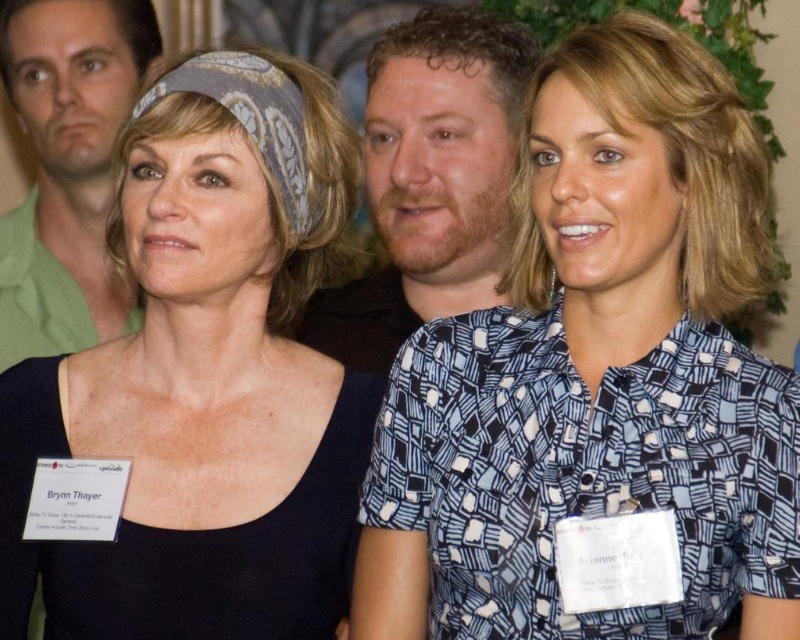
You are taking a photo of the blue printed blouse at center and the bearded man at center. Which one is closer to you?

The blue printed blouse at center is closer to the viewer than the bearded man at center.

You are at a formal event and want to greet the person wearing the black matte dress at center. Which direction should you move relative to the blue printed blouse at center?

The blue printed blouse at center is to the right of the black matte dress at center. Therefore, to greet the person wearing the black matte dress at center, you should move to the left relative to the blue printed blouse at center.

Which person is wearing the black matte dress at center?

The individual in the center is wearing the black matte dress at center.